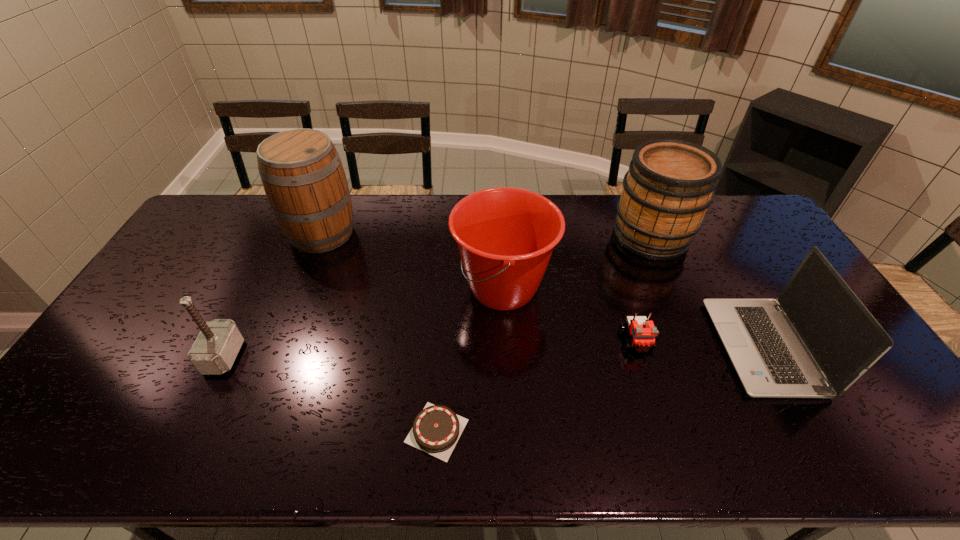
You are a GUI agent. You are given a task and a screenshot of the screen. Output one action in this format:
    pyautogui.click(x=<x>, y=<y>)
    Task: Click on the unoccupied area between the Lego and the laptop computer
    This screenshot has width=960, height=540.
    Given the screenshot: What is the action you would take?
    click(x=699, y=344)

At what (x,y) coordinates should I click in order to perform the action: click on free space between the right cider and the bucket. Please return your answer as a coordinate pair (x, y). The width and height of the screenshot is (960, 540). Looking at the image, I should click on (577, 262).

Locate an element on the screen. blank region between the shortest object and the bucket is located at coordinates (470, 359).

Select which object is the fourth closest to the bucket. Please provide its 2D coordinates. Your answer should be formatted as a tuple, i.e. [(x, y)], where the tuple contains the x and y coordinates of a point satisfying the conditions above.

[(301, 171)]

Select which object is the fifth closest to the chocolate cake. Please provide its 2D coordinates. Your answer should be formatted as a tuple, i.e. [(x, y)], where the tuple contains the x and y coordinates of a point satisfying the conditions above.

[(817, 339)]

This screenshot has width=960, height=540. I want to click on free space that satisfies the following two spatial constraints: 1. on the front side of the left cider; 2. on the left side of the shortest object, so (243, 430).